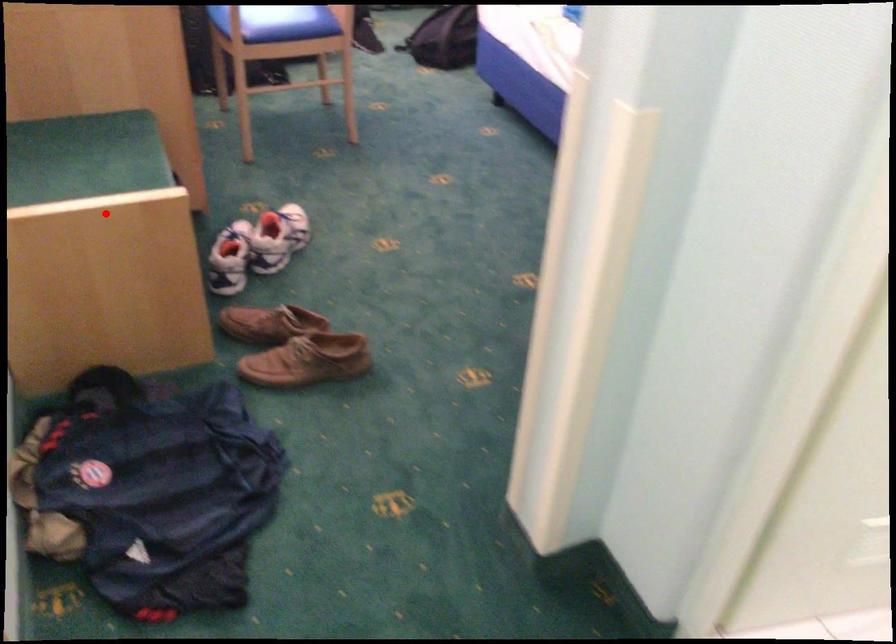
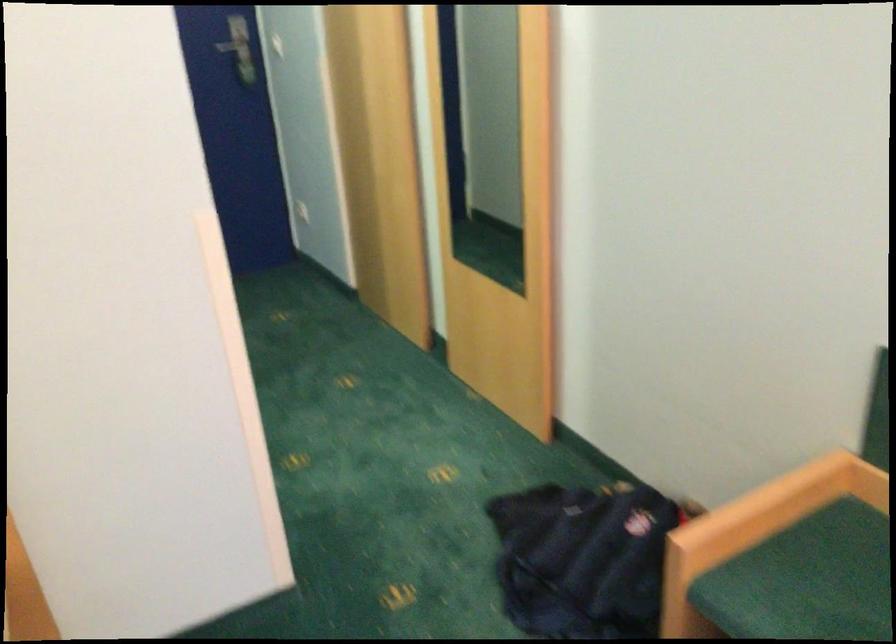
Question: I am providing you with two images of the same scene from different viewpoints. In image1, a red point is highlighted. Considering the same 3D point in image2, which of the following is correct?

Choices:
 (A) It is closer
 (B) It is farther

Answer: (A)